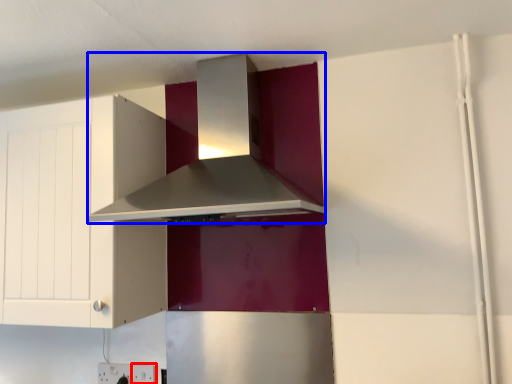
Question: Which object is closer to the camera taking this photo, electric outlet (highlighted by a red box) or home appliance (highlighted by a blue box)?

Choices:
 (A) electric outlet
 (B) home appliance

Answer: (B)